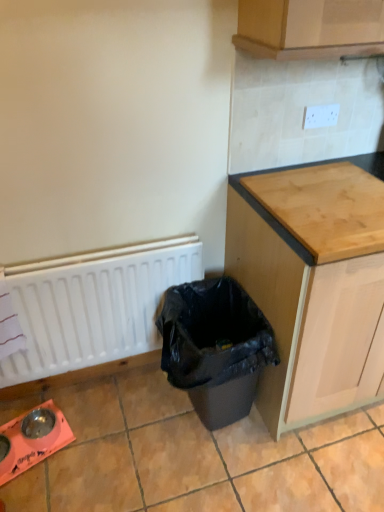
Question: From the image's perspective, would you say light brown wood at upper right is positioned over white matte radiator at lower left?

Choices:
 (A) no
 (B) yes

Answer: (B)

Question: Can white matte radiator at lower left be found inside light brown wood at upper right?

Choices:
 (A) yes
 (B) no

Answer: (B)

Question: Can you confirm if light brown wood at upper right is positioned to the left of white matte radiator at lower left?

Choices:
 (A) no
 (B) yes

Answer: (A)

Question: Is light brown wood at upper right shorter than white matte radiator at lower left?

Choices:
 (A) no
 (B) yes

Answer: (B)

Question: Is light brown wood at upper right positioned with its back to white matte radiator at lower left?

Choices:
 (A) no
 (B) yes

Answer: (A)

Question: Is light brown wood at upper right to the left or to the right of white matte radiator at lower left in the image?

Choices:
 (A) right
 (B) left

Answer: (A)

Question: Considering the positions of light brown wood at upper right and white matte radiator at lower left in the image, is light brown wood at upper right taller or shorter than white matte radiator at lower left?

Choices:
 (A) short
 (B) tall

Answer: (A)

Question: In terms of width, does light brown wood at upper right look wider or thinner when compared to white matte radiator at lower left?

Choices:
 (A) wide
 (B) thin

Answer: (A)

Question: From the image's perspective, is light brown wood at upper right positioned above or below white matte radiator at lower left?

Choices:
 (A) below
 (B) above

Answer: (B)

Question: From the image's perspective, is wooden cabinet at right located above or below white matte radiator at lower left?

Choices:
 (A) above
 (B) below

Answer: (A)

Question: Considering the positions of wooden cabinet at right and white matte radiator at lower left in the image, is wooden cabinet at right bigger or smaller than white matte radiator at lower left?

Choices:
 (A) big
 (B) small

Answer: (A)

Question: Is point (304, 224) closer or farther from the camera than point (110, 321)?

Choices:
 (A) farther
 (B) closer

Answer: (B)

Question: Considering their positions, is wooden cabinet at right located in front of or behind white matte radiator at lower left?

Choices:
 (A) behind
 (B) front

Answer: (B)

Question: From the image's perspective, is wooden cabinet at right located above or below light brown wood at upper right?

Choices:
 (A) above
 (B) below

Answer: (B)

Question: Visually, is wooden cabinet at right positioned to the left or to the right of light brown wood at upper right?

Choices:
 (A) right
 (B) left

Answer: (A)